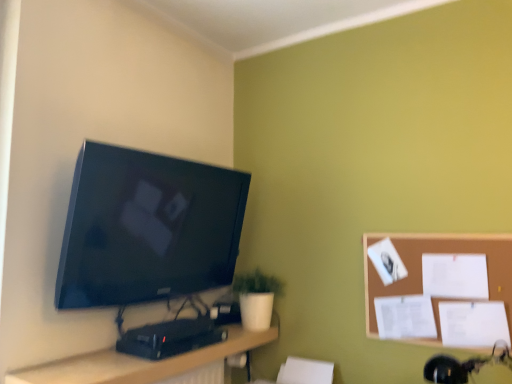
Question: From a real-world perspective, is wooden desk at lower center below white matte pot at lower center?

Choices:
 (A) no
 (B) yes

Answer: (B)

Question: Is wooden desk at lower center in front of white matte pot at lower center?

Choices:
 (A) no
 (B) yes

Answer: (B)

Question: Is wooden desk at lower center further to the viewer compared to white matte pot at lower center?

Choices:
 (A) no
 (B) yes

Answer: (A)

Question: Would you say wooden desk at lower center is a long distance from white matte pot at lower center?

Choices:
 (A) yes
 (B) no

Answer: (B)

Question: Considering the relative sizes of wooden desk at lower center and white matte pot at lower center in the image provided, is wooden desk at lower center thinner than white matte pot at lower center?

Choices:
 (A) no
 (B) yes

Answer: (B)

Question: Can you confirm if wooden desk at lower center is smaller than white matte pot at lower center?

Choices:
 (A) no
 (B) yes

Answer: (A)

Question: Is matte black tv at upper left positioned in front of white matte pot at lower center?

Choices:
 (A) no
 (B) yes

Answer: (B)

Question: Is matte black tv at upper left shorter than white matte pot at lower center?

Choices:
 (A) no
 (B) yes

Answer: (A)

Question: Does matte black tv at upper left have a smaller size compared to white matte pot at lower center?

Choices:
 (A) no
 (B) yes

Answer: (A)

Question: From the image's perspective, is matte black tv at upper left above white matte pot at lower center?

Choices:
 (A) yes
 (B) no

Answer: (A)

Question: Can white matte pot at lower center be found inside matte black tv at upper left?

Choices:
 (A) yes
 (B) no

Answer: (B)

Question: Is matte black tv at upper left outside white matte pot at lower center?

Choices:
 (A) no
 (B) yes

Answer: (B)

Question: Can you confirm if brown corkboard at right is wider than white matte pot at lower center?

Choices:
 (A) yes
 (B) no

Answer: (B)